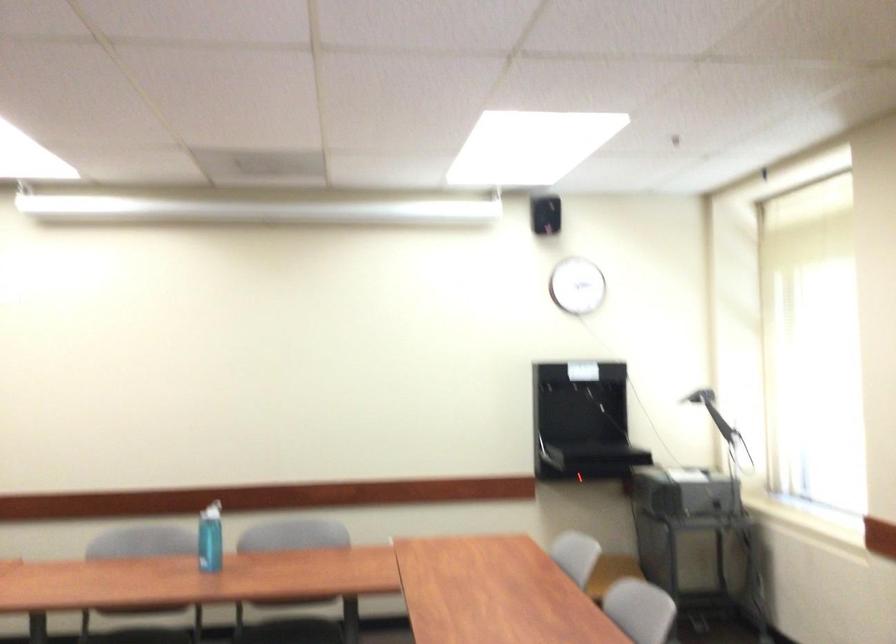
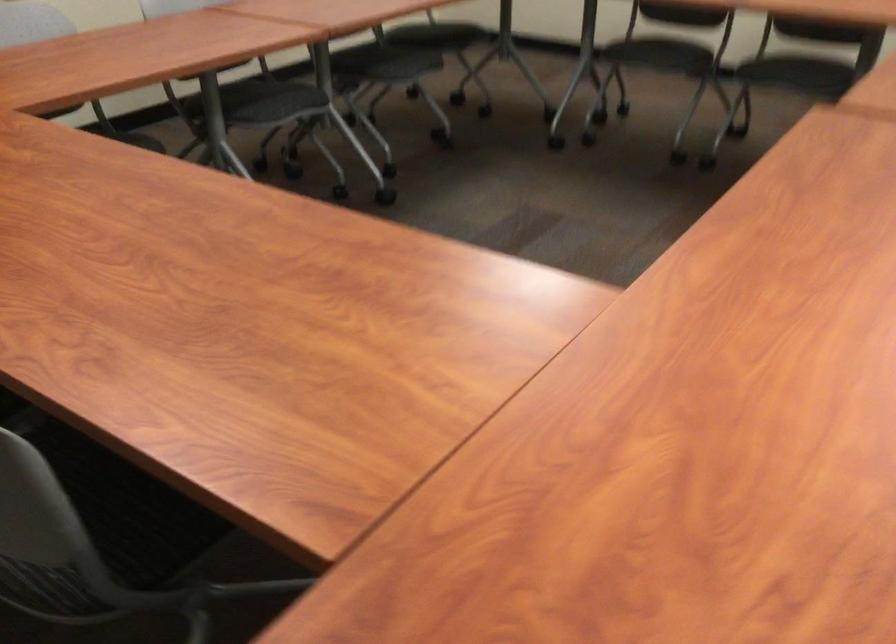
The images are taken continuously from a first-person perspective. In which direction is your viewpoint rotating?

The rotation direction of the camera is left-down.